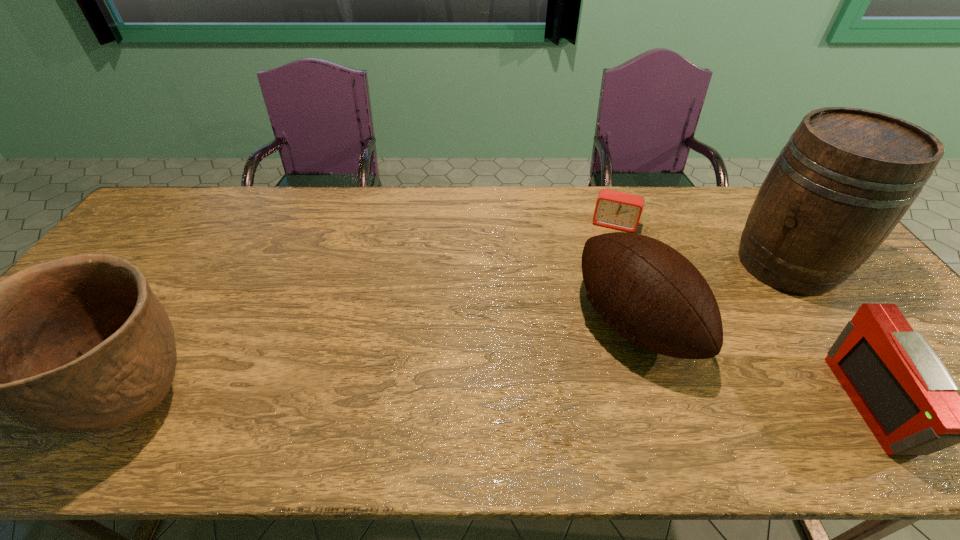
This screenshot has width=960, height=540. I want to click on football located at the near edge, so click(x=647, y=291).

Find the location of a particular element. The width and height of the screenshot is (960, 540). object at the right edge is located at coordinates (846, 177).

Identify the location of free space at the far edge. (694, 199).

Where is `free region at the right edge of the desktop`? The height and width of the screenshot is (540, 960). free region at the right edge of the desktop is located at coordinates (828, 301).

Locate an element on the screen. The image size is (960, 540). free point between the camera and the football is located at coordinates point(755,363).

Identify the location of empty space that is in between the fourth tallest object and the shortest object. (745, 314).

The height and width of the screenshot is (540, 960). Identify the location of free space between the fourth shortest object and the alarm clock. (378, 314).

This screenshot has height=540, width=960. What are the coordinates of `free space between the second shortest object and the third shortest object` in the screenshot? It's located at (755, 363).

Locate an element on the screen. The width and height of the screenshot is (960, 540). free spot between the leftmost object and the third tallest object is located at coordinates (388, 364).

Where is `free space between the alarm clock and the second tallest object`? free space between the alarm clock and the second tallest object is located at coordinates (378, 314).